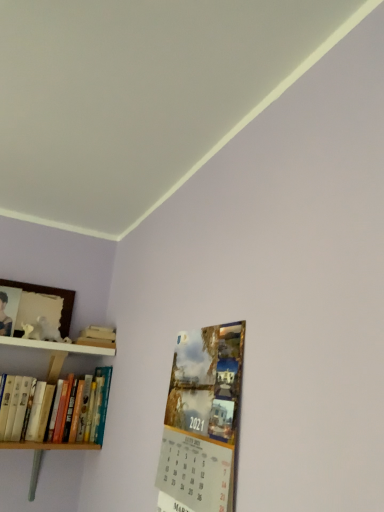
At what (x,y) coordinates should I click in order to perform the action: click on wooden shelf at upper left. Please return your answer as a coordinate pair (x, y). The height and width of the screenshot is (512, 384). Looking at the image, I should click on (75, 346).

Does hardcover books at left have a lesser height compared to matte paper calendar at lower right?

Yes.

Is hardcover books at left in front of or behind matte paper calendar at lower right in the image?

In the image, hardcover books at left appears behind matte paper calendar at lower right.

Is hardcover books at left turned away from matte paper calendar at lower right?

Answer: No, hardcover books at left's orientation is not away from matte paper calendar at lower right.

Can you confirm if hardcover books at left is smaller than matte paper calendar at lower right?

No, hardcover books at left is not smaller than matte paper calendar at lower right.

From the picture: From a real-world perspective, who is located higher, wooden shelf at upper left or matte paper calendar at lower right?

From a 3D spatial view, wooden shelf at upper left is above.

Can you confirm if wooden shelf at upper left is taller than matte paper calendar at lower right?

No, wooden shelf at upper left is not taller than matte paper calendar at lower right.

From the image's perspective, is wooden shelf at upper left located above or below matte paper calendar at lower right?

From the image's perspective, wooden shelf at upper left appears above matte paper calendar at lower right.

From the picture: Is the depth of wooden shelf at upper left less than that of matte paper calendar at lower right?

No, wooden shelf at upper left is behind matte paper calendar at lower right.

Between matte paper calendar at lower right and hardcover books at left, which one has less height?

hardcover books at left is shorter.

Is matte paper calendar at lower right positioned far away from hardcover books at left?

No, there isn't a large distance between matte paper calendar at lower right and hardcover books at left.

From a real-world perspective, is matte paper calendar at lower right under hardcover books at left?

No, from a real-world perspective, matte paper calendar at lower right is not below hardcover books at left.

From the image's perspective, is matte paper calendar at lower right located above or below wooden shelf at upper left?

From the image's perspective, matte paper calendar at lower right appears below wooden shelf at upper left.

This screenshot has height=512, width=384. Identify the location of magazine on the right of wooden shelf at upper left. (203, 420).

Can you confirm if matte paper calendar at lower right is bigger than wooden shelf at upper left?

Yes, matte paper calendar at lower right is bigger than wooden shelf at upper left.

From a real-world perspective, does hardcover books at left stand above wooden shelf at upper left?

No, from a real-world perspective, hardcover books at left is not on top of wooden shelf at upper left.

Does hardcover books at left have a smaller size compared to wooden shelf at upper left?

No, hardcover books at left is not smaller than wooden shelf at upper left.

This screenshot has width=384, height=512. I want to click on book in front of the wooden shelf at upper left, so click(x=77, y=431).

From a real-world perspective, between wooden shelf at upper left and hardcover books at left, who is vertically higher?

wooden shelf at upper left.

Consider the image. Is wooden shelf at upper left positioned in front of hardcover books at left?

No, wooden shelf at upper left is behind hardcover books at left.

From the image's perspective, is wooden shelf at upper left under hardcover books at left?

No.

Which of these two, wooden shelf at upper left or hardcover books at left, is smaller?

With smaller size is wooden shelf at upper left.

Locate an element on the screen. This screenshot has height=512, width=384. book behind the matte paper calendar at lower right is located at coordinates (77, 431).

Find the location of a particular element. magazine below the wooden shelf at upper left (from a real-world perspective) is located at coordinates (203, 420).

Estimate the real-world distances between objects in this image. Which object is further from matte paper calendar at lower right, wooden shelf at upper left or hardcover books at left?

Among the two, wooden shelf at upper left is located further to matte paper calendar at lower right.

Estimate the real-world distances between objects in this image. Which object is further from hardcover books at left, wooden shelf at upper left or matte paper calendar at lower right?

The object further to hardcover books at left is matte paper calendar at lower right.

When comparing their distances from matte paper calendar at lower right, does hardcover books at left or wooden shelf at upper left seem further?

wooden shelf at upper left lies further to matte paper calendar at lower right than the other object.

When comparing their distances from wooden shelf at upper left, does hardcover books at left or matte paper calendar at lower right seem closer?

Based on the image, hardcover books at left appears to be nearer to wooden shelf at upper left.

Which object lies nearer to the anchor point wooden shelf at upper left, matte paper calendar at lower right or hardcover books at left?

Among the two, hardcover books at left is located nearer to wooden shelf at upper left.

Looking at the image, which one is located further to hardcover books at left, matte paper calendar at lower right or wooden shelf at upper left?

Among the two, matte paper calendar at lower right is located further to hardcover books at left.

Locate an element on the screen. The height and width of the screenshot is (512, 384). book between matte paper calendar at lower right and wooden shelf at upper left along the z-axis is located at coordinates (77, 431).